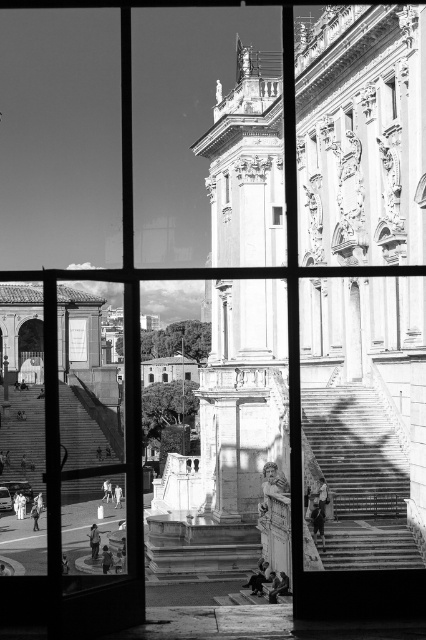
Does smooth concrete stairs at lower right appear over stone staircase at lower left?

Indeed, smooth concrete stairs at lower right is positioned over stone staircase at lower left.

Is point (325, 440) positioned in front of point (31, 452)?

Yes, it is in front of point (31, 452).

Image resolution: width=426 pixels, height=640 pixels. Identify the location of smooth concrete stairs at lower right. (359, 477).

Which is more to the left, stone staircase at lower left or transparent glass window at center?

From the viewer's perspective, stone staircase at lower left appears more on the left side.

Can you confirm if stone staircase at lower left is taller than transparent glass window at center?

Yes, stone staircase at lower left is taller than transparent glass window at center.

Locate an element on the screen. stone staircase at lower left is located at coordinates (23, 440).

Does smooth concrete stairs at lower right appear on the right side of transparent glass window at center?

Yes, smooth concrete stairs at lower right is to the right of transparent glass window at center.

Between smooth concrete stairs at lower right and transparent glass window at center, which one has more height?

smooth concrete stairs at lower right is taller.

Find the location of a particular element. Image resolution: width=426 pixels, height=640 pixels. smooth concrete stairs at lower right is located at coordinates (359, 477).